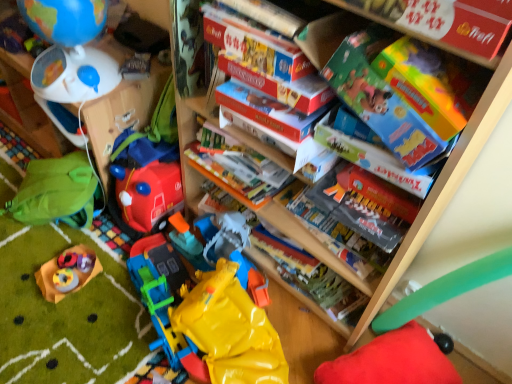
Question: Should I look upward or downward to see red plush cushion at lower right, which ranks as the sixth toy in left-to-right order?

Choices:
 (A) up
 (B) down

Answer: (B)

Question: From the image's perspective, is rubberized yellow toy at lower left, placed as the 4th toy when sorted from right to left, located beneath green fabric backpack at left, the first shelf from the front?

Choices:
 (A) no
 (B) yes

Answer: (B)

Question: Are rubberized yellow toy at lower left, placed as the 4th toy when sorted from right to left, and green fabric backpack at left, the first shelf from the front, located far from each other?

Choices:
 (A) yes
 (B) no

Answer: (B)

Question: Does rubberized yellow toy at lower left, placed as the 4th toy when sorted from right to left, have a smaller size compared to green fabric backpack at left, which ranks as the 2th shelf in back-to-front order?

Choices:
 (A) no
 (B) yes

Answer: (B)

Question: Considering the relative sizes of rubberized yellow toy at lower left, which appears as the 3th toy when viewed from the left, and green fabric backpack at left, which ranks as the 2th shelf in back-to-front order, in the image provided, is rubberized yellow toy at lower left, which appears as the 3th toy when viewed from the left, wider than green fabric backpack at left, which ranks as the 2th shelf in back-to-front order,?

Choices:
 (A) yes
 (B) no

Answer: (B)

Question: Is rubberized yellow toy at lower left, which appears as the 3th toy when viewed from the left, directly adjacent to green fabric backpack at left, positioned as the second shelf in left-to-right order?

Choices:
 (A) no
 (B) yes

Answer: (A)

Question: Is rubberized yellow toy at lower left, which appears as the 3th toy when viewed from the left, bigger than green fabric backpack at left, positioned as the second shelf in left-to-right order?

Choices:
 (A) yes
 (B) no

Answer: (B)

Question: Considering the relative sizes of red plastic toy car at lower left, which ranks as the third toy in right-to-left order, and hardcover book at center, placed as the 1th book when sorted from back to front, in the image provided, is red plastic toy car at lower left, which ranks as the third toy in right-to-left order, bigger than hardcover book at center, placed as the 1th book when sorted from back to front,?

Choices:
 (A) no
 (B) yes

Answer: (A)

Question: Is red plastic toy car at lower left, which ranks as the third toy in right-to-left order, positioned behind hardcover book at center, which ranks as the 4th book in front-to-back order?

Choices:
 (A) no
 (B) yes

Answer: (B)

Question: Does red plastic toy car at lower left, which ranks as the third toy in right-to-left order, come in front of hardcover book at center, placed as the 1th book when sorted from back to front?

Choices:
 (A) yes
 (B) no

Answer: (B)

Question: Could you tell me if red plastic toy car at lower left, placed as the 4th toy when sorted from left to right, is facing hardcover book at center, placed as the 1th book when sorted from back to front?

Choices:
 (A) no
 (B) yes

Answer: (A)

Question: Is red plastic toy car at lower left, which ranks as the third toy in right-to-left order, thinner than hardcover book at center, which ranks as the 4th book in front-to-back order?

Choices:
 (A) no
 (B) yes

Answer: (B)

Question: Is red plastic toy car at lower left, placed as the 4th toy when sorted from left to right, located outside hardcover book at center, placed as the 1th book when sorted from back to front?

Choices:
 (A) yes
 (B) no

Answer: (A)

Question: Does matte blue globe at upper left, positioned as the first toy in left-to-right order, have a greater width compared to red plush cushion at lower right, which ranks as the sixth toy in left-to-right order?

Choices:
 (A) yes
 (B) no

Answer: (B)